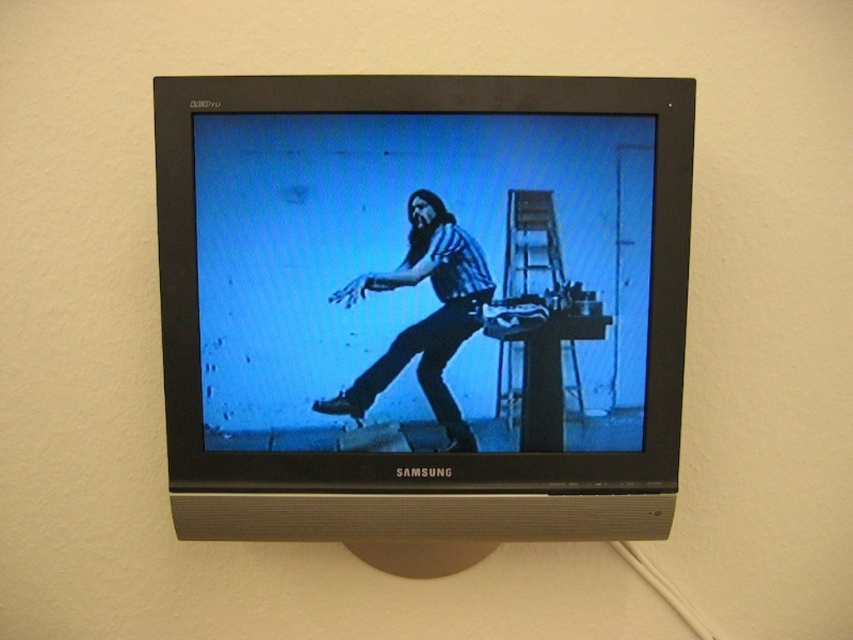
Does matte black monitor at center appear over matte blue jeans at center?

Correct, matte black monitor at center is located above matte blue jeans at center.

Locate an element on the screen. The height and width of the screenshot is (640, 853). matte black monitor at center is located at coordinates (421, 278).

The image size is (853, 640). I want to click on matte black monitor at center, so click(421, 278).